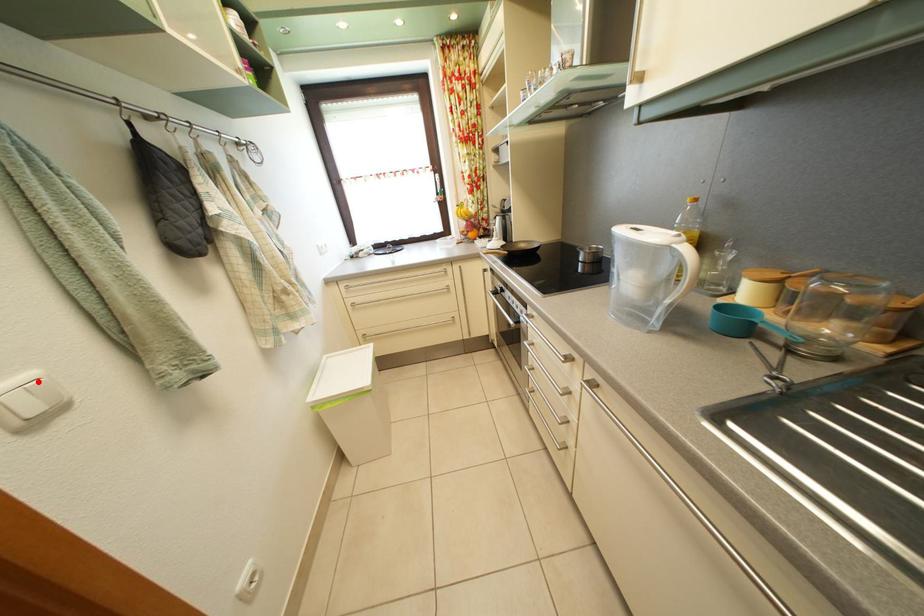
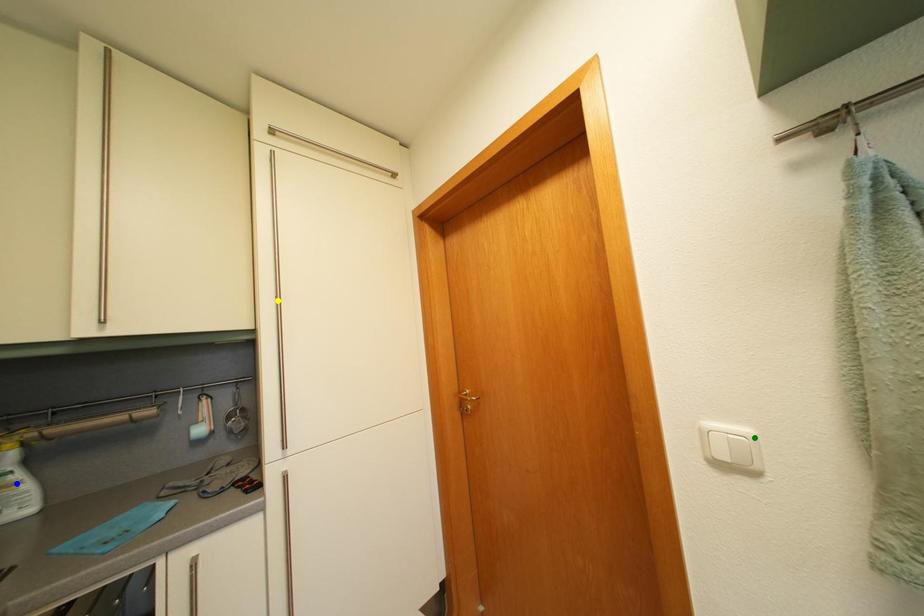
Question: I am providing you with two images of the same scene from different viewpoints. A red point is marked on the first image. You are given multiple points on the second image. Which point in image 2 is actually the same real-world point as the red point in image 1?

Choices:
 (A) yellow point
 (B) green point
 (C) blue point

Answer: (B)